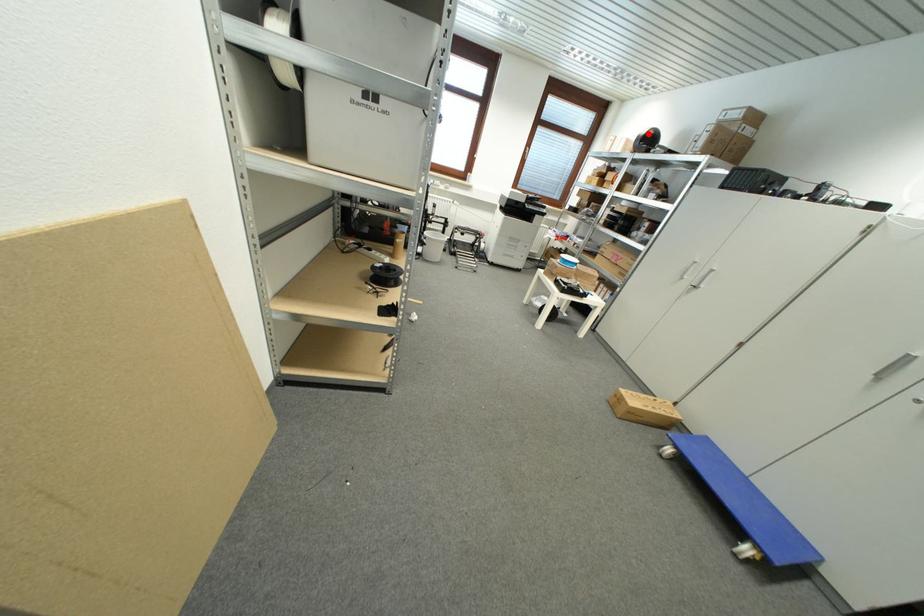
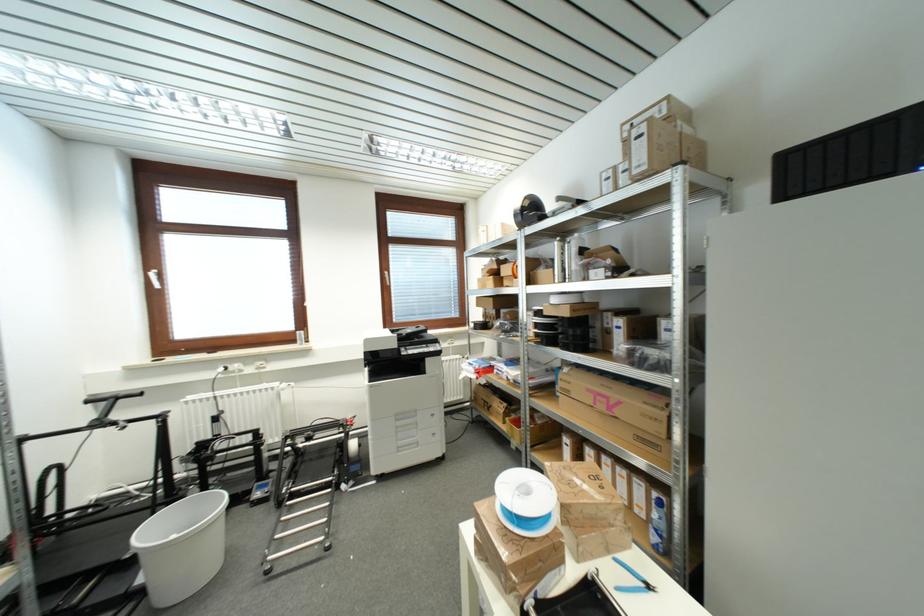
The point at the highlighted location is marked in the first image. Where is the corresponding point in the second image?

(523, 207)